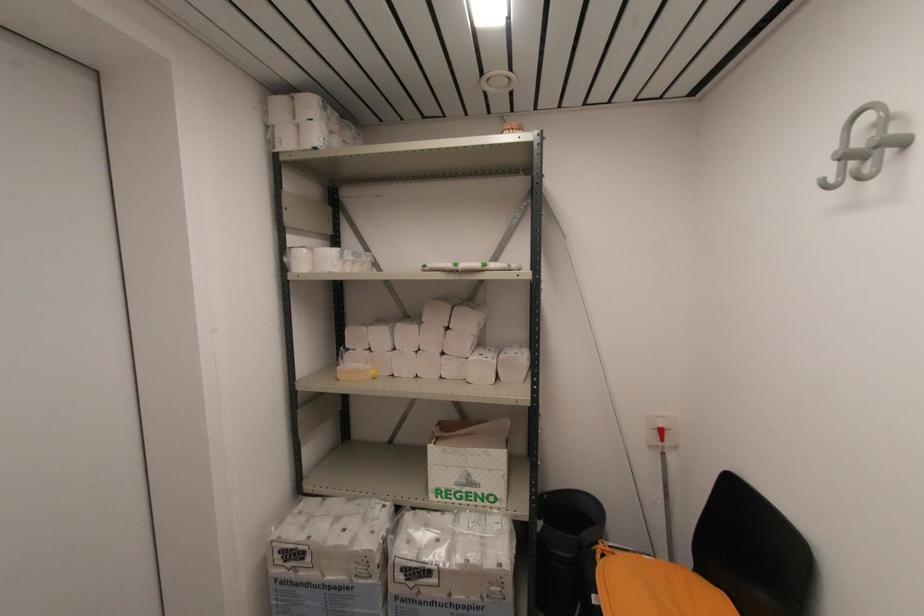
Where is `orange chair sitting surface`? The image size is (924, 616). orange chair sitting surface is located at coordinates (655, 589).